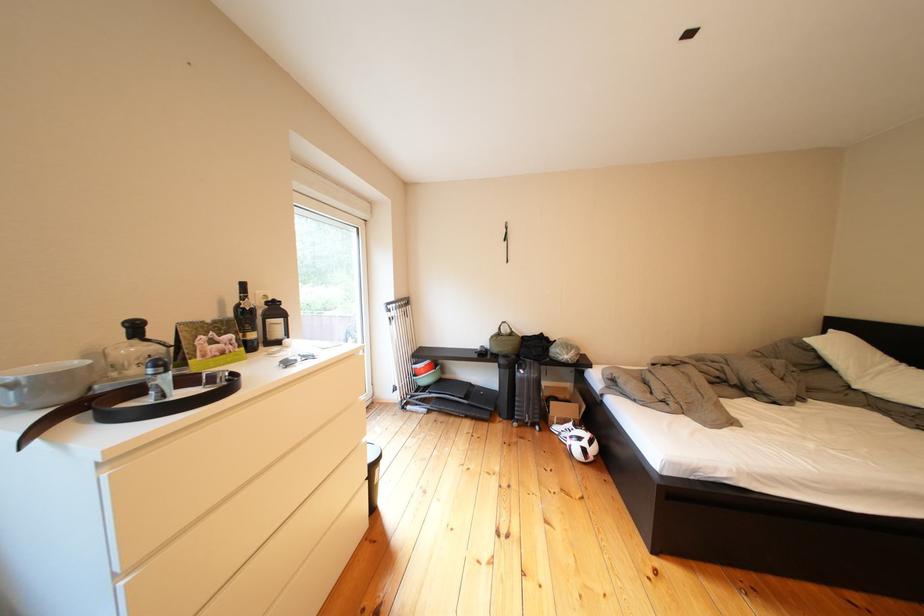
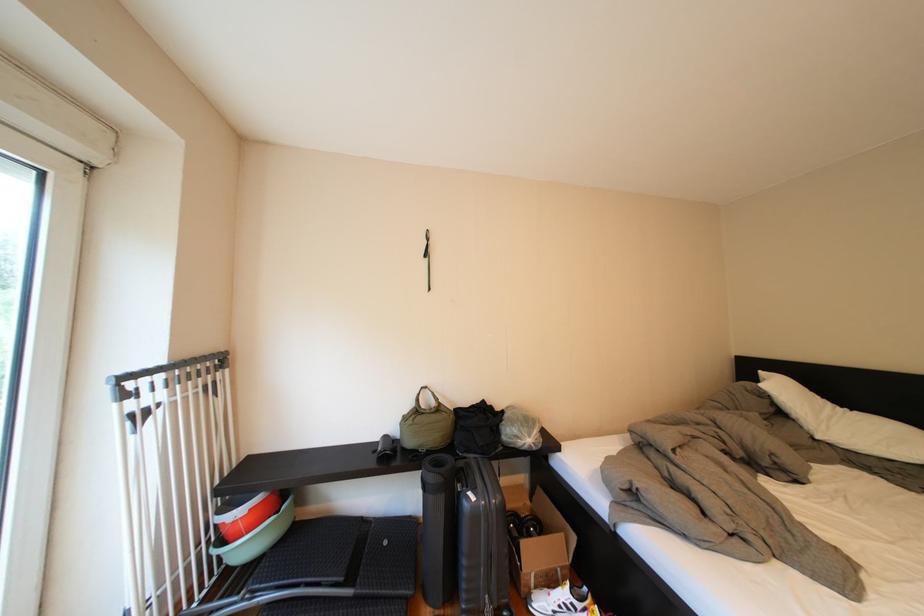
Where in the second image is the point corresponding to pixel 569 413 from the first image?

(544, 557)